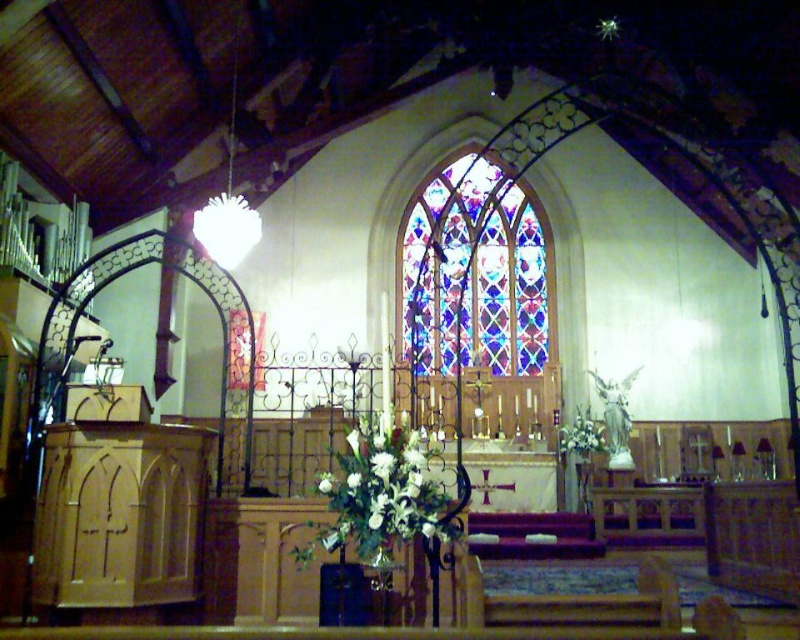
Question: Is stained glass window at center smaller than white floral bouquet at center?

Choices:
 (A) no
 (B) yes

Answer: (A)

Question: Is stained glass window at center to the right of white floral bouquet at center from the viewer's perspective?

Choices:
 (A) yes
 (B) no

Answer: (A)

Question: Which point is closer to the camera?

Choices:
 (A) (466, 186)
 (B) (405, 499)

Answer: (B)

Question: Does stained glass window at center appear on the left side of white floral bouquet at center?

Choices:
 (A) no
 (B) yes

Answer: (A)